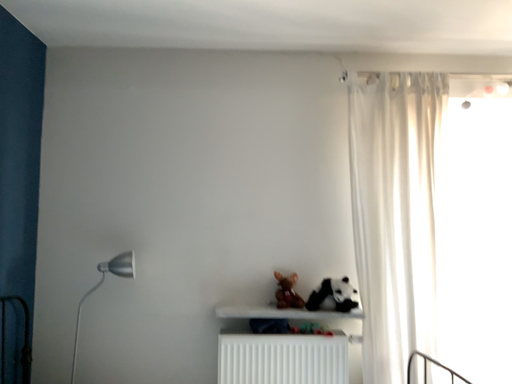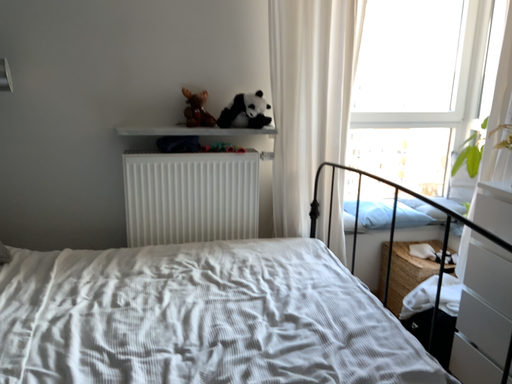
Question: Which way did the camera rotate in the video?

Choices:
 (A) rotated downward
 (B) rotated upward

Answer: (A)